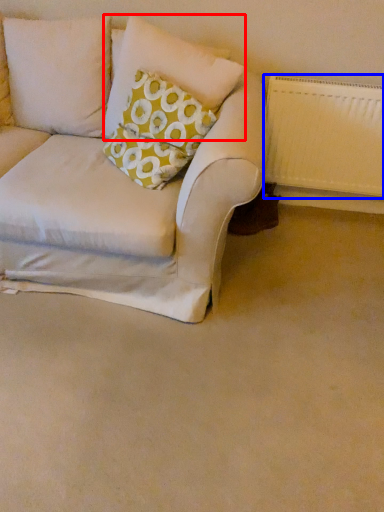
Question: Among these objects, which one is nearest to the camera, pillow (highlighted by a red box) or radiator (highlighted by a blue box)?

Choices:
 (A) pillow
 (B) radiator

Answer: (A)